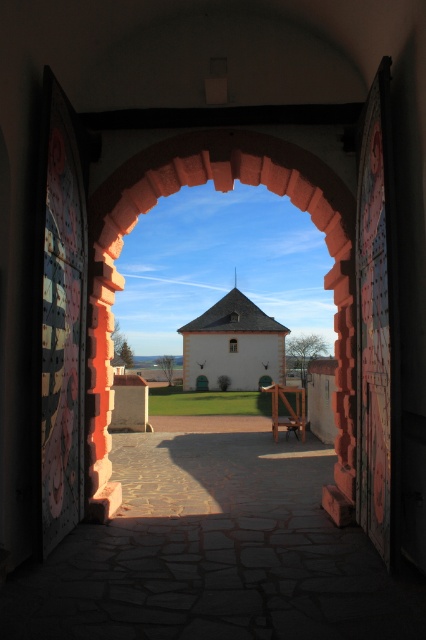
Is point (198, 131) positioned in front of point (236, 348)?

Yes, point (198, 131) is closer to viewer.

Which is above, brick stone archway at center or clear glass window at center?

brick stone archway at center is above.

Who is more distant from viewer, (108, 196) or (236, 340)?

Positioned behind is point (236, 340).

Find the location of a particular element. brick stone archway at center is located at coordinates (221, 189).

Can you confirm if white smooth stone chapel at center is smaller than clear glass window at center?

No.

Does point (187, 355) lie in front of point (232, 348)?

That is True.

The image size is (426, 640). In order to click on white smooth stone chapel at center in this screenshot , I will do `click(227, 346)`.

Is brick stone archway at center taller than white smooth stone chapel at center?

In fact, brick stone archway at center may be shorter than white smooth stone chapel at center.

Does brick stone archway at center come in front of white smooth stone chapel at center?

Yes, brick stone archway at center is closer to the viewer.

This screenshot has height=640, width=426. I want to click on brick stone archway at center, so click(221, 189).

Identify the location of brick stone archway at center. This screenshot has width=426, height=640. (221, 189).